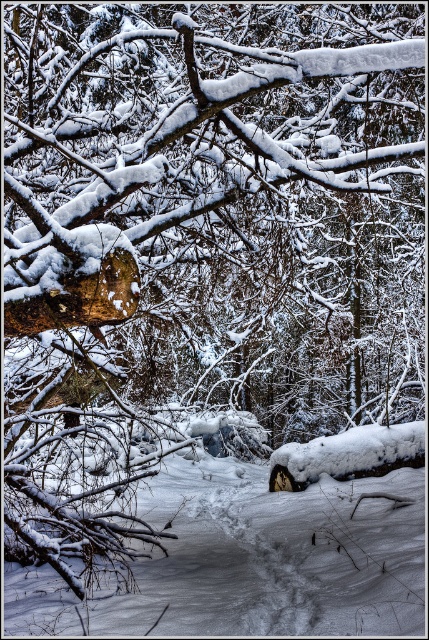
Is smooth brown log at upper left bigger than white fluffy snow at center?

Indeed, smooth brown log at upper left has a larger size compared to white fluffy snow at center.

Between point (117, 64) and point (205, 570), which one is positioned behind?

Positioned behind is point (117, 64).

The image size is (429, 640). Identify the location of smooth brown log at upper left. (192, 115).